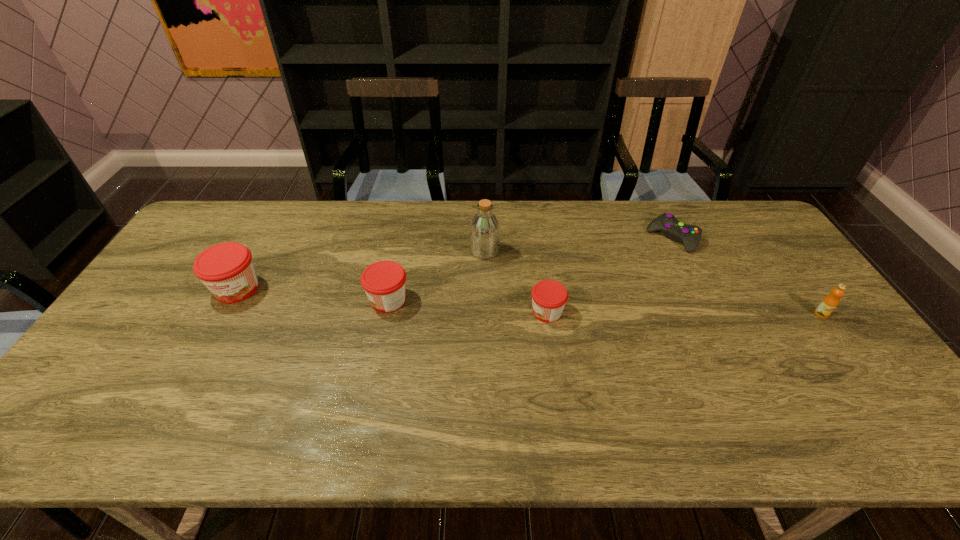
With all jams evenly spaced, where should an extra jam be placed on the right to continue the pattern? Please point out a vacant space. Please provide its 2D coordinates. Your answer should be formatted as a tuple, i.e. [(x, y)], where the tuple contains the x and y coordinates of a point satisfying the conditions above.

[(714, 325)]